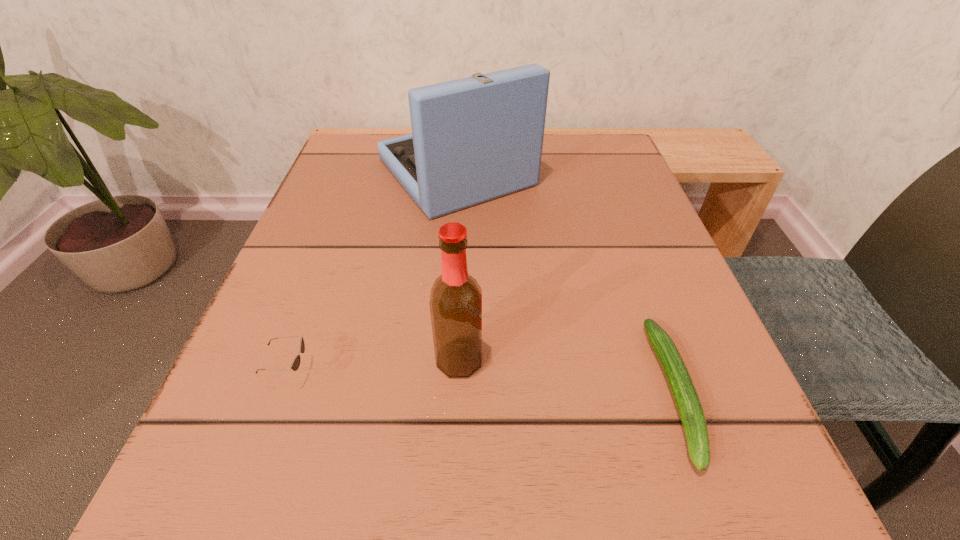
Locate an element on the screen. Image resolution: width=960 pixels, height=540 pixels. vacant area at the near right corner of the desktop is located at coordinates (774, 531).

At what (x,y) coordinates should I click in order to perform the action: click on free spot between the beer bottle and the shortest object. Please return your answer as a coordinate pair (x, y). Looking at the image, I should click on (567, 376).

What are the coordinates of `unoccupied area between the beer bottle and the zucchini` in the screenshot? It's located at (567, 376).

Identify the location of empty space between the phonograph record and the zucchini. (565, 282).

Identify the location of vacant area that lies between the shortest object and the beer bottle. (567, 376).

Image resolution: width=960 pixels, height=540 pixels. What are the coordinates of `free spot between the zucchini and the sunglasses` in the screenshot? It's located at click(483, 382).

You are a GUI agent. You are given a task and a screenshot of the screen. Output one action in this format:
    pyautogui.click(x=<x>, y=<y>)
    Task: Click on the free space between the sunglasses and the beer bottle
    This screenshot has height=540, width=960.
    Given the screenshot: What is the action you would take?
    pyautogui.click(x=375, y=367)

Identify the location of free spot between the shortest object and the beer bottle. Image resolution: width=960 pixels, height=540 pixels. (567, 376).

The width and height of the screenshot is (960, 540). Identify the location of the second closest object to the phonograph record. pos(688,404).

The image size is (960, 540). I want to click on the third closest object to the beer bottle, so click(475, 139).